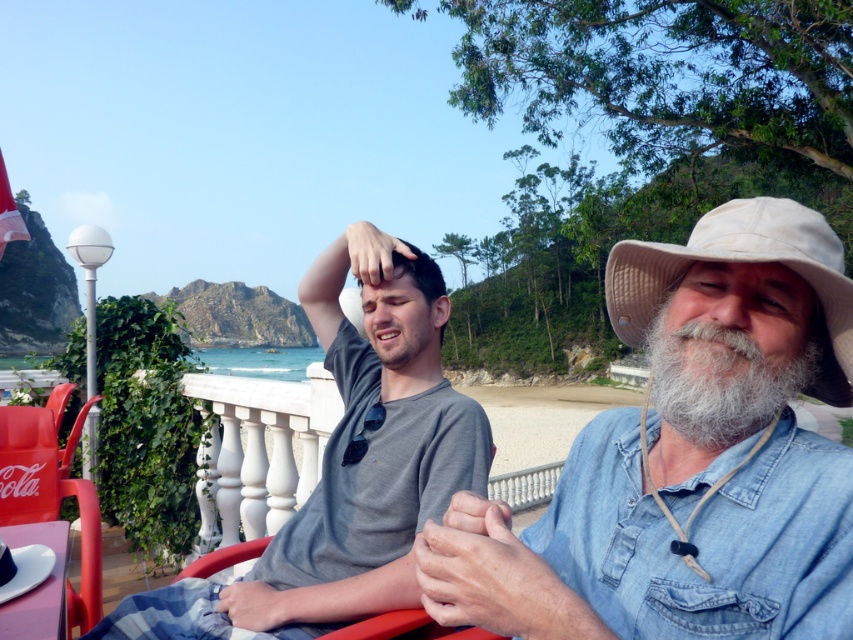
You are a photographer trying to capture a candid shot of the matte skin forehead at center without including the beige fabric cowboy hat at right in the frame. Is it possible to do so given their positions?

The beige fabric cowboy hat at right is to the right of the matte skin forehead at center, so by adjusting the camera angle to focus solely on the matte skin forehead at center and excluding the right side where the hat is located, it is possible to capture the shot without including the beige fabric cowboy hat at right.